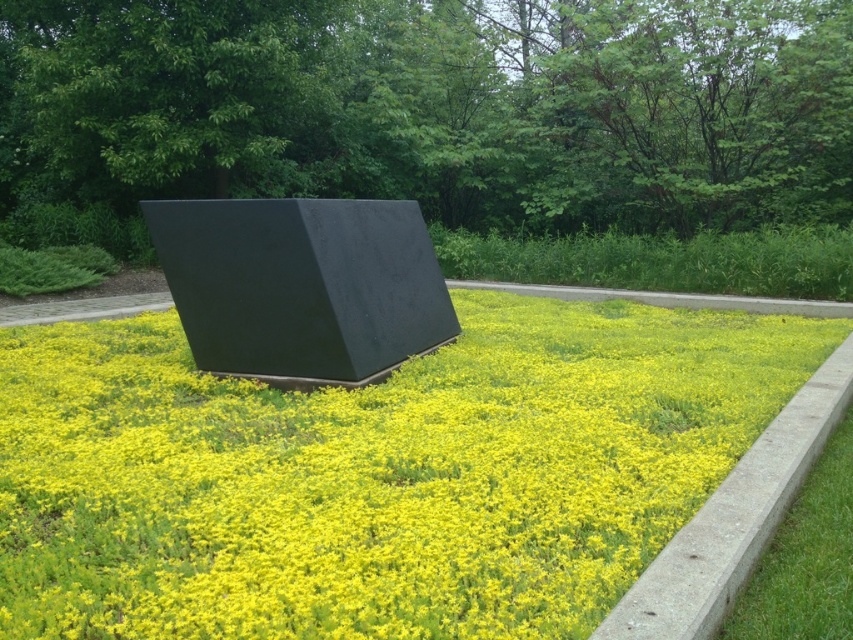
Question: Is concrete at center bigger than green grass at lower right?

Choices:
 (A) yes
 (B) no

Answer: (A)

Question: Which object appears closest to the camera in this image?

Choices:
 (A) green grass at lower right
 (B) yellow matte flower at center

Answer: (A)

Question: In this image, where is concrete at center located relative to green grass at lower right?

Choices:
 (A) left
 (B) right

Answer: (A)

Question: Which point appears farthest from the camera in this image?

Choices:
 (A) (399, 605)
 (B) (817, 627)
 (C) (822, 381)

Answer: (C)

Question: Among these objects, which one is nearest to the camera?

Choices:
 (A) concrete at center
 (B) green grass at lower right

Answer: (A)

Question: Can you confirm if yellow matte flower at center is thinner than green grass at lower right?

Choices:
 (A) no
 (B) yes

Answer: (A)